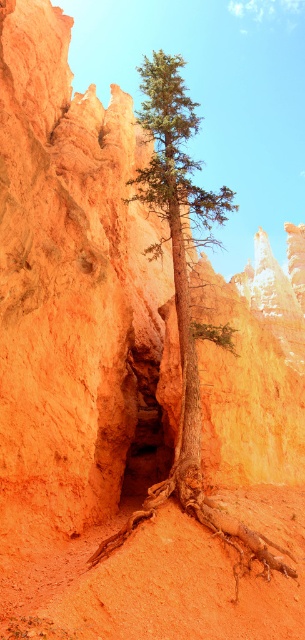
Can you confirm if brown rough tree root at center is smaller than brown rough tree root at lower center?

No, brown rough tree root at center is not smaller than brown rough tree root at lower center.

Between brown rough tree root at center and brown rough tree root at lower center, which one is positioned lower?

brown rough tree root at center is lower down.

Locate an element on the screen. brown rough tree root at center is located at coordinates (240, 534).

Is green matte tree at center above brown rough tree root at center?

Yes, green matte tree at center is above brown rough tree root at center.

Does green matte tree at center come behind brown rough tree root at center?

Yes, it is behind brown rough tree root at center.

Does point (218, 196) come behind point (240, 557)?

Yes.

I want to click on green matte tree at center, so click(x=179, y=237).

Is green matte tree at center thinner than brown rough tree root at lower center?

No.

Is green matte tree at center below brown rough tree root at lower center?

No, green matte tree at center is not below brown rough tree root at lower center.

The width and height of the screenshot is (305, 640). I want to click on green matte tree at center, so click(179, 237).